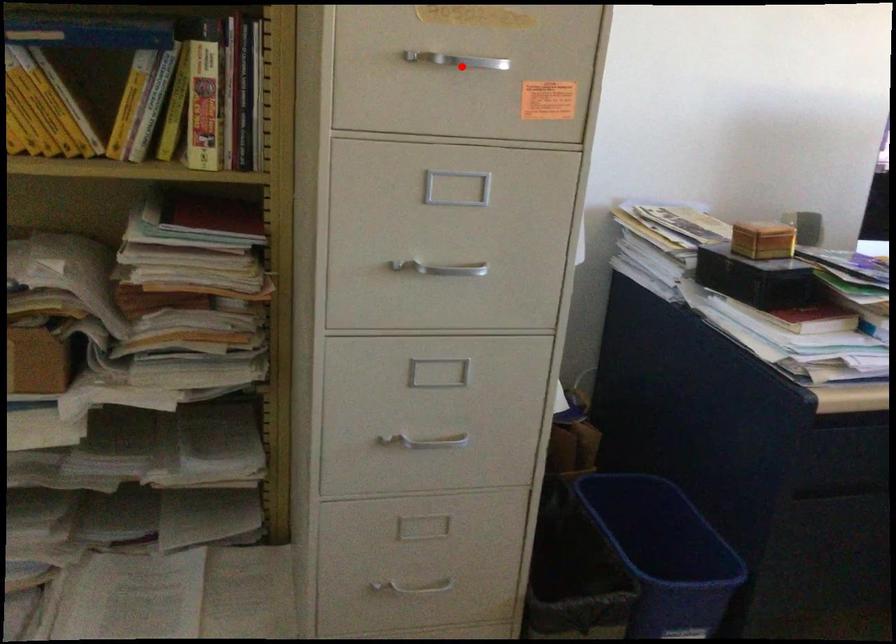
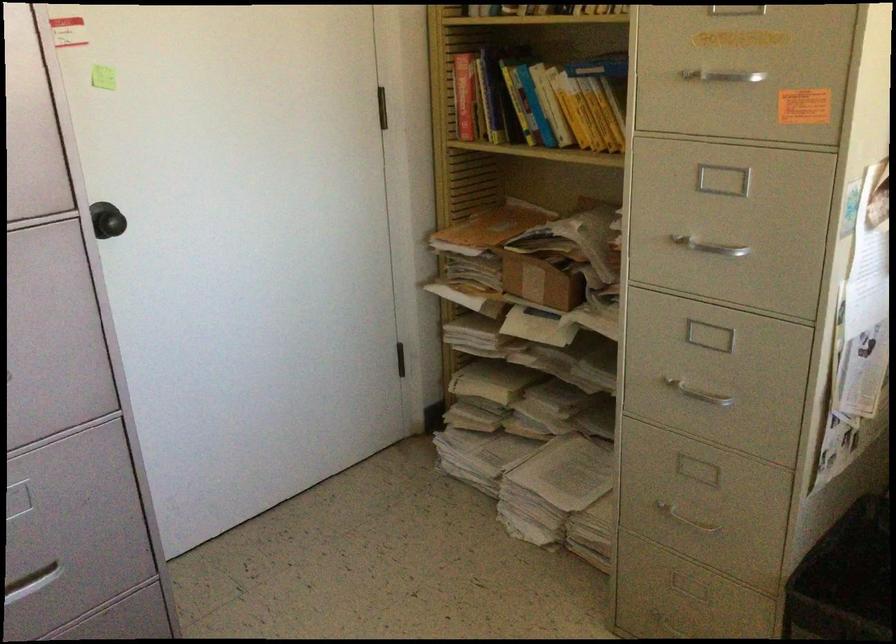
Question: I am providing you with two images of the same scene from different viewpoints. Given a red point in image1, look at the same physical point in image2. Is it:

Choices:
 (A) Closer to the viewpoint
 (B) Farther from the viewpoint

Answer: (B)